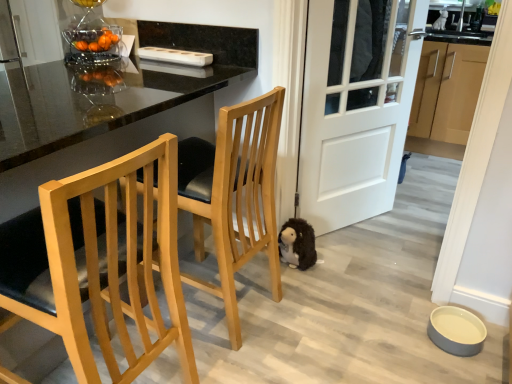
Question: Should I look upward or downward to see light brown wood cabinets at right?

Choices:
 (A) up
 (B) down

Answer: (A)

Question: Can you confirm if glossy black table at center is taller than white matte door at center?

Choices:
 (A) no
 (B) yes

Answer: (A)

Question: Is glossy black table at center further to camera compared to white matte door at center?

Choices:
 (A) yes
 (B) no

Answer: (B)

Question: Is glossy black table at center facing away from white matte door at center?

Choices:
 (A) no
 (B) yes

Answer: (A)

Question: Is glossy black table at center not near white matte door at center?

Choices:
 (A) yes
 (B) no

Answer: (B)

Question: Is glossy black table at center in contact with white matte door at center?

Choices:
 (A) yes
 (B) no

Answer: (B)

Question: Can you confirm if glossy black table at center is shorter than white matte door at center?

Choices:
 (A) yes
 (B) no

Answer: (A)

Question: Is the depth of light wood/texture chair at left, the 1th chair in the front-to-back sequence, less than that of fuzzy brown stuffed animal at lower center?

Choices:
 (A) no
 (B) yes

Answer: (B)

Question: Is light wood/texture chair at left, the 1th chair in the front-to-back sequence, not within fuzzy brown stuffed animal at lower center?

Choices:
 (A) no
 (B) yes

Answer: (B)

Question: From the image's perspective, does light wood/texture chair at left, the 1th chair in the front-to-back sequence, appear lower than fuzzy brown stuffed animal at lower center?

Choices:
 (A) no
 (B) yes

Answer: (B)

Question: Can you confirm if light wood/texture chair at left, the second chair from the back, is taller than fuzzy brown stuffed animal at lower center?

Choices:
 (A) no
 (B) yes

Answer: (B)

Question: Is light wood/texture chair at left, the 1th chair in the front-to-back sequence, to the left of fuzzy brown stuffed animal at lower center from the viewer's perspective?

Choices:
 (A) yes
 (B) no

Answer: (A)

Question: Is light wood/texture chair at left, the second chair from the back, bigger than fuzzy brown stuffed animal at lower center?

Choices:
 (A) no
 (B) yes

Answer: (B)

Question: Considering the relative sizes of fuzzy brown stuffed animal at lower center and light wood/black cushioned seat at center, which is the second chair in front-to-back order, in the image provided, is fuzzy brown stuffed animal at lower center smaller than light wood/black cushioned seat at center, which is the second chair in front-to-back order,?

Choices:
 (A) yes
 (B) no

Answer: (A)